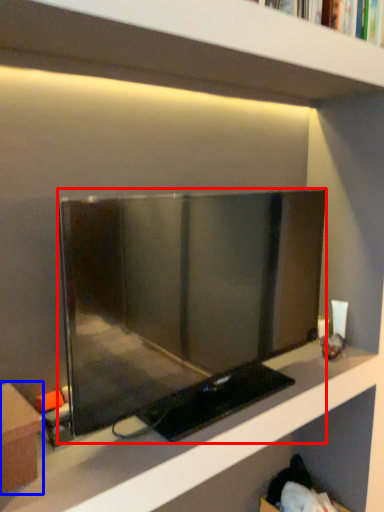
Question: Which object is closer to the camera taking this photo, television (highlighted by a red box) or furniture (highlighted by a blue box)?

Choices:
 (A) television
 (B) furniture

Answer: (B)